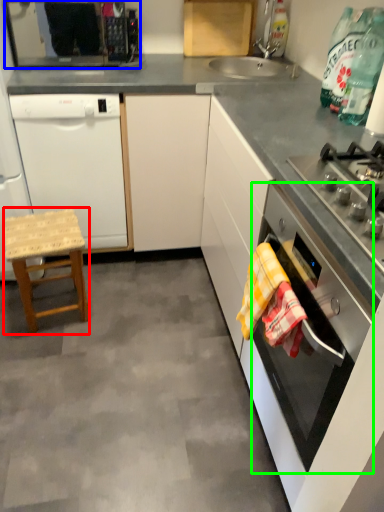
Question: Which object is positioned closest to stool (highlighted by a red box)? Select from kitchen appliance (highlighted by a blue box) and oven (highlighted by a green box).

Choices:
 (A) kitchen appliance
 (B) oven

Answer: (B)